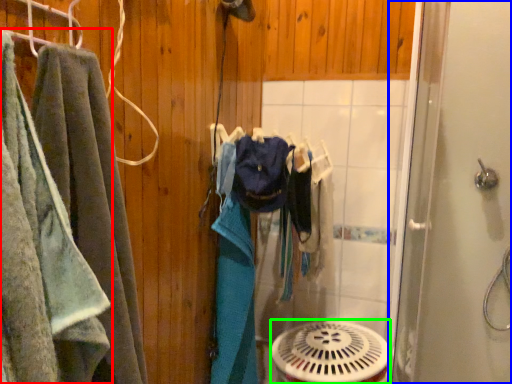
Question: Which object is the farthest from towel (highlighted by a red box)? Choose among these: screen door (highlighted by a blue box) or mechanical fan (highlighted by a green box).

Choices:
 (A) screen door
 (B) mechanical fan

Answer: (A)